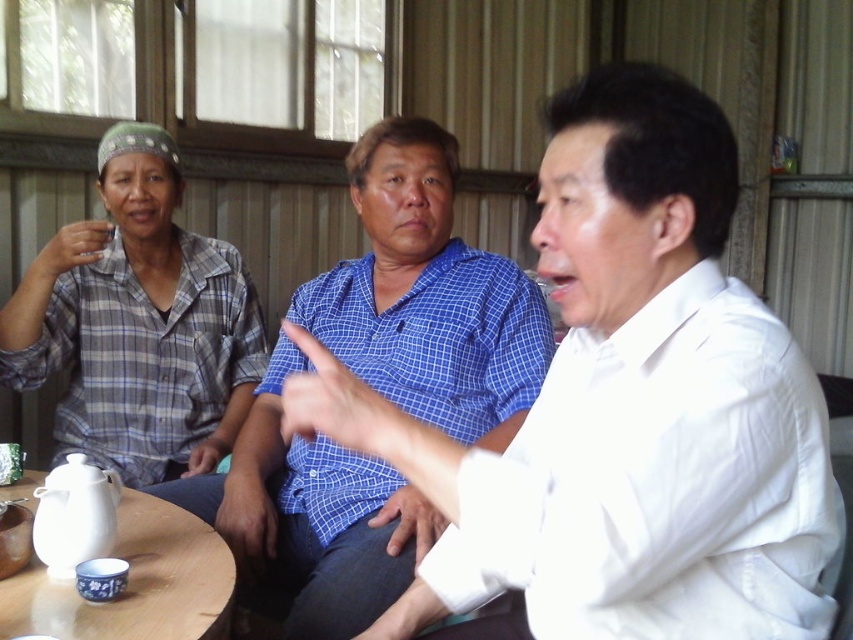
Is white cotton shirt at center shorter than white wood round table at lower left?

No.

Does white cotton shirt at center have a greater height compared to white wood round table at lower left?

Yes, white cotton shirt at center is taller than white wood round table at lower left.

The width and height of the screenshot is (853, 640). What do you see at coordinates (622, 410) in the screenshot?
I see `white cotton shirt at center` at bounding box center [622, 410].

The width and height of the screenshot is (853, 640). What are the coordinates of `white cotton shirt at center` in the screenshot? It's located at (622, 410).

Who is higher up, white cotton shirt at center or plaid fabric shirt at left?

plaid fabric shirt at left is above.

Does white cotton shirt at center have a lesser width compared to plaid fabric shirt at left?

No, white cotton shirt at center is not thinner than plaid fabric shirt at left.

Where is `white cotton shirt at center`? This screenshot has height=640, width=853. white cotton shirt at center is located at coordinates (622, 410).

Is white cotton shirt at center taller than blue checkered shirt at center?

No.

Measure the distance between white cotton shirt at center and camera.

white cotton shirt at center is 65.81 centimeters away from camera.

What do you see at coordinates (622, 410) in the screenshot? The width and height of the screenshot is (853, 640). I see `white cotton shirt at center` at bounding box center [622, 410].

Identify the location of white cotton shirt at center. This screenshot has height=640, width=853. (622, 410).